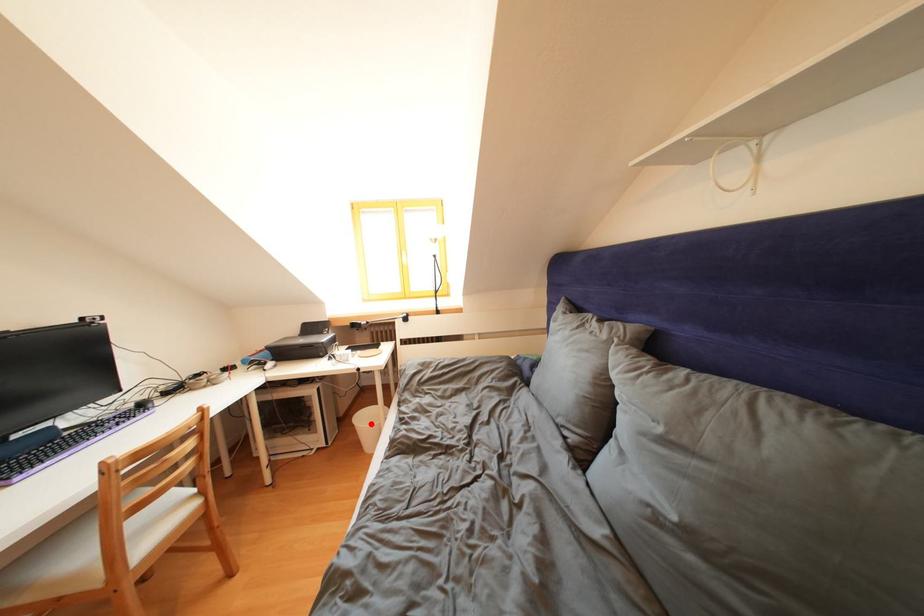
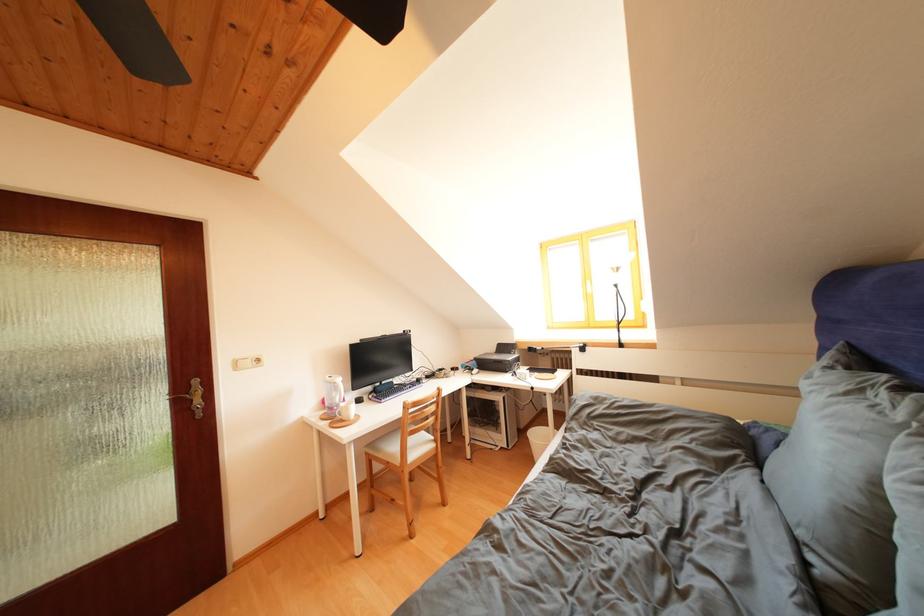
Where in the second image is the point corresponding to the highlighted location from the first image?

(542, 439)